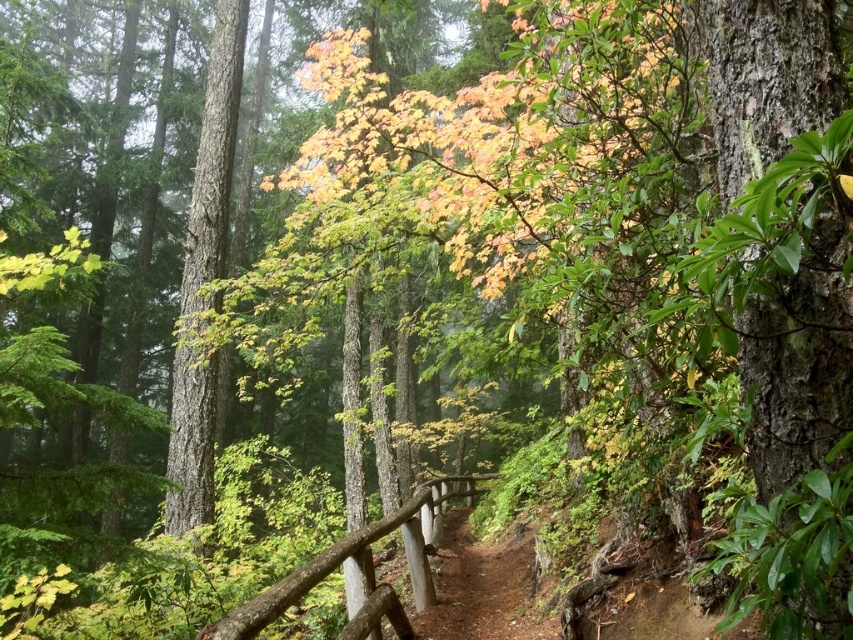
Does brown dirt trail at center come in front of brown wood rail at center?

No, it is not.

Who is lower down, brown dirt trail at center or brown wood rail at center?

Positioned lower is brown dirt trail at center.

Does point (471, 548) come farther from viewer compared to point (352, 540)?

Yes, point (471, 548) is behind point (352, 540).

Where is `brown dirt trail at center`? This screenshot has width=853, height=640. brown dirt trail at center is located at coordinates (482, 588).